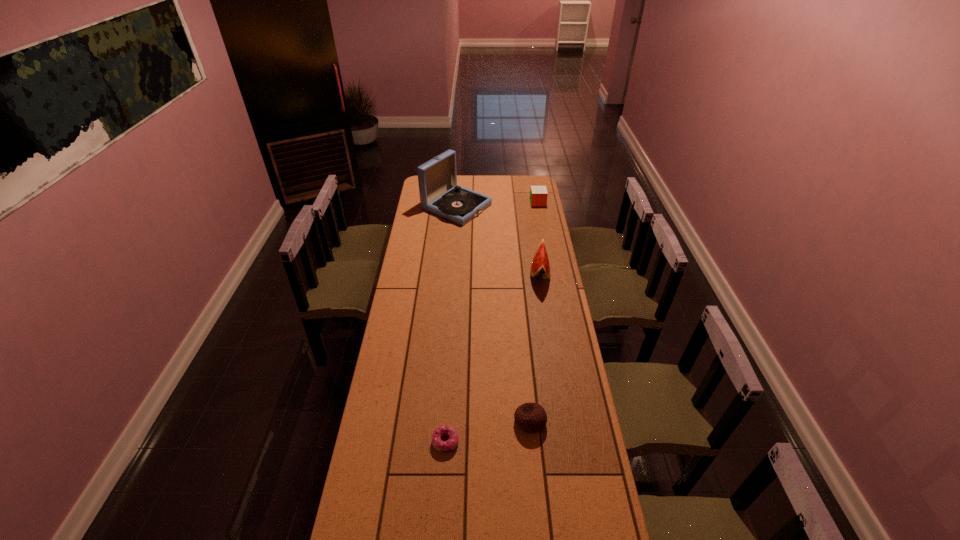
In the image, there is a desktop. Identify the location of vacant space at the left edge. The height and width of the screenshot is (540, 960). (415, 205).

The image size is (960, 540). Find the location of `vacant space at the right edge of the desktop`. vacant space at the right edge of the desktop is located at coordinates (528, 207).

The image size is (960, 540). What are the coordinates of `free spot between the beanbag and the tallest object` in the screenshot? It's located at (493, 314).

Where is `vacant point located between the tallest object and the third shortest object`? The width and height of the screenshot is (960, 540). vacant point located between the tallest object and the third shortest object is located at coordinates (497, 205).

The height and width of the screenshot is (540, 960). In order to click on empty location between the third farthest object and the shortest object in this screenshot , I will do `click(492, 357)`.

This screenshot has width=960, height=540. What are the coordinates of `vacant region between the phonograph record and the watermelon` in the screenshot? It's located at (498, 240).

The width and height of the screenshot is (960, 540). In order to click on free spot between the tallest object and the doughnut in this screenshot , I will do `click(451, 324)`.

At what (x,y) coordinates should I click in order to perform the action: click on vacant space that is in between the beanbag and the shortest object. Please return your answer as a coordinate pair (x, y). The width and height of the screenshot is (960, 540). Looking at the image, I should click on (488, 431).

Where is `free spot between the phonograph record and the shortest object`? The width and height of the screenshot is (960, 540). free spot between the phonograph record and the shortest object is located at coordinates (451, 324).

Locate an element on the screen. empty space between the beanbag and the phonograph record is located at coordinates click(493, 314).